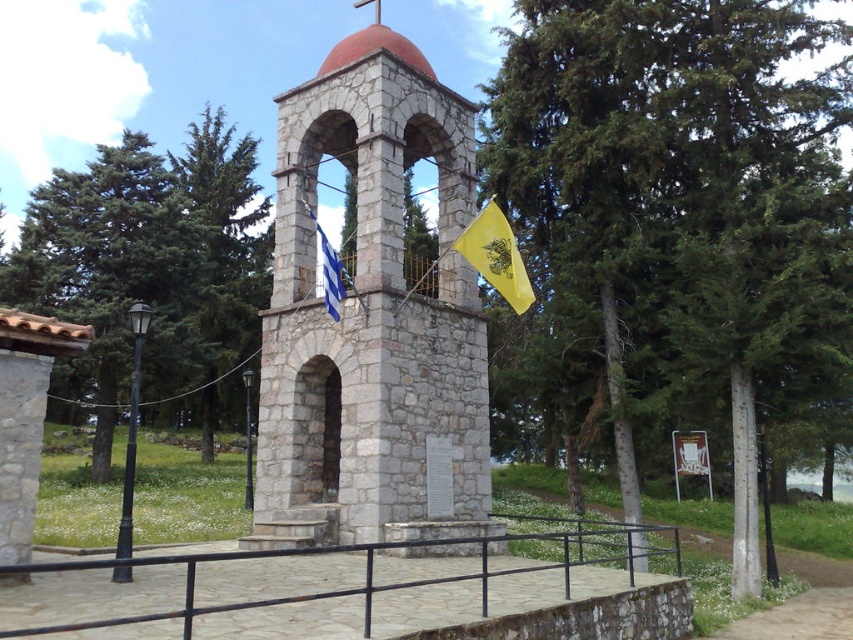
Can you confirm if black metal/rail at center is positioned below blue and white striped fabric at center?

Indeed, black metal/rail at center is positioned under blue and white striped fabric at center.

Does point (299, 561) lie behind point (326, 262)?

No, (299, 561) is in front of (326, 262).

Is point (325, 557) closer to viewer compared to point (332, 259)?

Yes.

Find the location of `black metal/rail at center`. black metal/rail at center is located at coordinates (347, 596).

Can you confirm if black metal/rail at center is positioned below yellow fabric flag at center?

Indeed, black metal/rail at center is positioned under yellow fabric flag at center.

Can you confirm if black metal/rail at center is taller than yellow fabric flag at center?

Yes, black metal/rail at center is taller than yellow fabric flag at center.

The width and height of the screenshot is (853, 640). I want to click on black metal/rail at center, so click(x=347, y=596).

Locate an element on the screen. This screenshot has width=853, height=640. black metal/rail at center is located at coordinates (347, 596).

Between yellow fabric flag at center and blue and white striped fabric at center, which one has more height?

With more height is yellow fabric flag at center.

In the scene shown: Measure the distance between yellow fabric flag at center and camera.

yellow fabric flag at center and camera are 15.68 meters apart from each other.

The image size is (853, 640). Identify the location of yellow fabric flag at center. (496, 256).